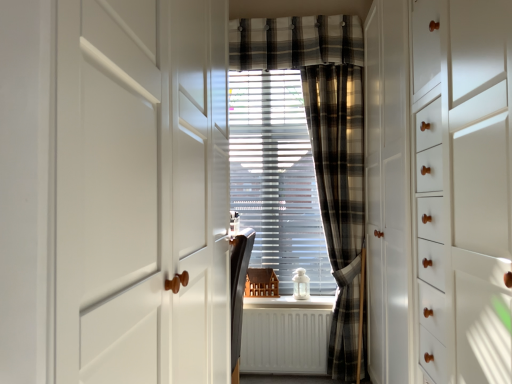
In order to face white matte radiator at center, should I rotate leftwards or rightwards?

It's best to rotate right around 4.876 degrees.

This screenshot has width=512, height=384. Describe the element at coordinates (290, 302) in the screenshot. I see `white glossy window sill at center` at that location.

This screenshot has height=384, width=512. Identify the location of white matte cabinet at right, which is the first door in right-to-left order. (439, 190).

What do you see at coordinates (439, 190) in the screenshot? Image resolution: width=512 pixels, height=384 pixels. I see `white matte cabinet at right, which ranks as the second door in left-to-right order` at bounding box center [439, 190].

Where is `white matte radiator at center`? This screenshot has height=384, width=512. white matte radiator at center is located at coordinates (285, 341).

Does white matte door at left, which ranks as the 1th door in left-to-right order, lie behind wooden miniature house at center, the 1th furniture when ordered from back to front?

No, white matte door at left, which ranks as the 1th door in left-to-right order, is in front of wooden miniature house at center, the 1th furniture when ordered from back to front.

Looking at their sizes, would you say white matte door at left, the 2th door viewed from the right, is wider or thinner than wooden miniature house at center, marked as the 2th furniture in a front-to-back arrangement?

Clearly, white matte door at left, the 2th door viewed from the right, has more width compared to wooden miniature house at center, marked as the 2th furniture in a front-to-back arrangement.

Is white matte door at left, the 2th door viewed from the right, beside wooden miniature house at center, marked as the 2th furniture in a front-to-back arrangement?

No, white matte door at left, the 2th door viewed from the right, is not touching wooden miniature house at center, marked as the 2th furniture in a front-to-back arrangement.

Consider the image. Can you confirm if white matte door at left, the 2th door viewed from the right, is taller than wooden miniature house at center, the 1th furniture when ordered from back to front?

Indeed, white matte door at left, the 2th door viewed from the right, has a greater height compared to wooden miniature house at center, the 1th furniture when ordered from back to front.

Is white matte door at left, which ranks as the 1th door in left-to-right order, to the left or to the right of white matte radiator at center in the image?

white matte door at left, which ranks as the 1th door in left-to-right order, is positioned on white matte radiator at center's left side.

Can we say white matte door at left, the 2th door viewed from the right, lies outside white matte radiator at center?

white matte door at left, the 2th door viewed from the right, is positioned outside white matte radiator at center.

From the image's perspective, relative to matte black chair at center, which ranks as the 2th furniture in back-to-front order, is white plastic blinds at center above or below?

Clearly, from the image's perspective, white plastic blinds at center is above matte black chair at center, which ranks as the 2th furniture in back-to-front order.

Does white plastic blinds at center have a lesser width compared to matte black chair at center, which ranks as the 2th furniture in back-to-front order?

→ Indeed, white plastic blinds at center has a lesser width compared to matte black chair at center, which ranks as the 2th furniture in back-to-front order.

Which object is closer to the camera, white plastic blinds at center or matte black chair at center, which ranks as the 2th furniture in back-to-front order?

matte black chair at center, which ranks as the 2th furniture in back-to-front order.

Between white plastic blinds at center and matte black chair at center, which ranks as the 2th furniture in back-to-front order, which one has less height?

Standing shorter between the two is matte black chair at center, which ranks as the 2th furniture in back-to-front order.

From the image's perspective, which one is positioned higher, matte black chair at center, the first furniture positioned from the front, or white matte cabinet at right, which is the first door in right-to-left order?

white matte cabinet at right, which is the first door in right-to-left order.

Looking at this image, considering the relative positions of matte black chair at center, the first furniture positioned from the front, and white matte cabinet at right, which is the first door in right-to-left order, in the image provided, is matte black chair at center, the first furniture positioned from the front, behind white matte cabinet at right, which is the first door in right-to-left order,?

Yes, matte black chair at center, the first furniture positioned from the front, is further from the viewer.

From a real-world perspective, between matte black chair at center, the first furniture positioned from the front, and white matte cabinet at right, which ranks as the second door in left-to-right order, who is vertically higher?

white matte cabinet at right, which ranks as the second door in left-to-right order, from a real-world perspective.

Could you measure the distance between matte black chair at center, the first furniture positioned from the front, and white matte cabinet at right, which ranks as the second door in left-to-right order?

A distance of 37.30 inches exists between matte black chair at center, the first furniture positioned from the front, and white matte cabinet at right, which ranks as the second door in left-to-right order.

Considering the relative sizes of white glossy window sill at center and white matte door at left, which ranks as the 1th door in left-to-right order, in the image provided, is white glossy window sill at center shorter than white matte door at left, which ranks as the 1th door in left-to-right order,?

Yes, white glossy window sill at center is shorter than white matte door at left, which ranks as the 1th door in left-to-right order.

In order to click on door that is the 2nd one above the white glossy window sill at center (from a real-world perspective) in this screenshot , I will do coord(114,191).

From a real-world perspective, who is located higher, white glossy window sill at center or white matte door at left, which ranks as the 1th door in left-to-right order?

From a 3D spatial view, white matte door at left, which ranks as the 1th door in left-to-right order, is above.

Consider the image. What's the angular difference between plaid fabric curtain at center and white matte radiator at center's facing directions?

There is a 0.247-degree angle between the facing directions of plaid fabric curtain at center and white matte radiator at center.

From a real-world perspective, which object stands above the other?

In real-world perspective, plaid fabric curtain at center is above.

Does plaid fabric curtain at center come in front of white matte radiator at center?

Yes, plaid fabric curtain at center is in front of white matte radiator at center.

Considering the positions of points (347, 85) and (312, 371), is point (347, 85) closer to camera compared to point (312, 371)?

No, (347, 85) is further to viewer.

Which object is thinner, white glossy window sill at center or matte black chair at center, which ranks as the 2th furniture in back-to-front order?

matte black chair at center, which ranks as the 2th furniture in back-to-front order.

Is matte black chair at center, which ranks as the 2th furniture in back-to-front order, located within white glossy window sill at center?

No, white glossy window sill at center does not contain matte black chair at center, which ranks as the 2th furniture in back-to-front order.

Measure the distance from white glossy window sill at center to matte black chair at center, the first furniture positioned from the front.

white glossy window sill at center is 28.58 inches from matte black chair at center, the first furniture positioned from the front.

Can you confirm if white glossy window sill at center is shorter than matte black chair at center, the first furniture positioned from the front?

Correct, white glossy window sill at center is not as tall as matte black chair at center, the first furniture positioned from the front.

The image size is (512, 384). What are the coordinates of `door lying on the left of wooden miniature house at center, marked as the 2th furniture in a front-to-back arrangement` in the screenshot? It's located at (114, 191).

Where is `radiator behind the white matte door at left, the 2th door viewed from the right`? radiator behind the white matte door at left, the 2th door viewed from the right is located at coordinates (285, 341).

Estimate the real-world distances between objects in this image. Which object is closer to plaid fabric curtain at center, plaid fabric curtain at center or white matte radiator at center?

white matte radiator at center lies closer to plaid fabric curtain at center than the other object.

From the image, which object appears to be farther from matte black chair at center, which ranks as the 2th furniture in back-to-front order, wooden miniature house at center, the 1th furniture when ordered from back to front, or white glossy window sill at center?

wooden miniature house at center, the 1th furniture when ordered from back to front, is further to matte black chair at center, which ranks as the 2th furniture in back-to-front order.

When comparing their distances from wooden miniature house at center, the 1th furniture when ordered from back to front, does white glossy window sill at center or white matte cabinet at right, which is the first door in right-to-left order, seem further?

Among the two, white matte cabinet at right, which is the first door in right-to-left order, is located further to wooden miniature house at center, the 1th furniture when ordered from back to front.

Estimate the real-world distances between objects in this image. Which object is closer to plaid fabric curtain at center, white matte radiator at center or white matte door at left, which ranks as the 1th door in left-to-right order?

white matte radiator at center lies closer to plaid fabric curtain at center than the other object.

When comparing their distances from white glossy window sill at center, does wooden miniature house at center, the 1th furniture when ordered from back to front, or white matte door at left, the 2th door viewed from the right, seem further?

Based on the image, white matte door at left, the 2th door viewed from the right, appears to be further to white glossy window sill at center.

Which object lies further to the anchor point white matte cabinet at right, which ranks as the second door in left-to-right order, white plastic blinds at center or white glossy window sill at center?

Based on the image, white glossy window sill at center appears to be further to white matte cabinet at right, which ranks as the second door in left-to-right order.

When comparing their distances from white matte radiator at center, does white matte cabinet at right, which ranks as the second door in left-to-right order, or white plastic blinds at center seem closer?

white plastic blinds at center lies closer to white matte radiator at center than the other object.

Estimate the real-world distances between objects in this image. Which object is further from white matte radiator at center, white glossy window sill at center or plaid fabric curtain at center?

plaid fabric curtain at center.

Locate an element on the screen. The width and height of the screenshot is (512, 384). window blind between plaid fabric curtain at center and white plastic toy at center from top to bottom is located at coordinates (276, 177).

Find the location of a particular element. plaid located between white matte cabinet at right, which is the first door in right-to-left order, and white plastic toy at center in the depth direction is located at coordinates (295, 42).

This screenshot has width=512, height=384. Find the location of `window sill located between white matte door at left, which ranks as the 1th door in left-to-right order, and wooden miniature house at center, marked as the 2th furniture in a front-to-back arrangement, in the depth direction`. window sill located between white matte door at left, which ranks as the 1th door in left-to-right order, and wooden miniature house at center, marked as the 2th furniture in a front-to-back arrangement, in the depth direction is located at coordinates (290, 302).

The height and width of the screenshot is (384, 512). I want to click on curtain between white matte door at left, which ranks as the 1th door in left-to-right order, and white plastic blinds at center from front to back, so click(340, 201).